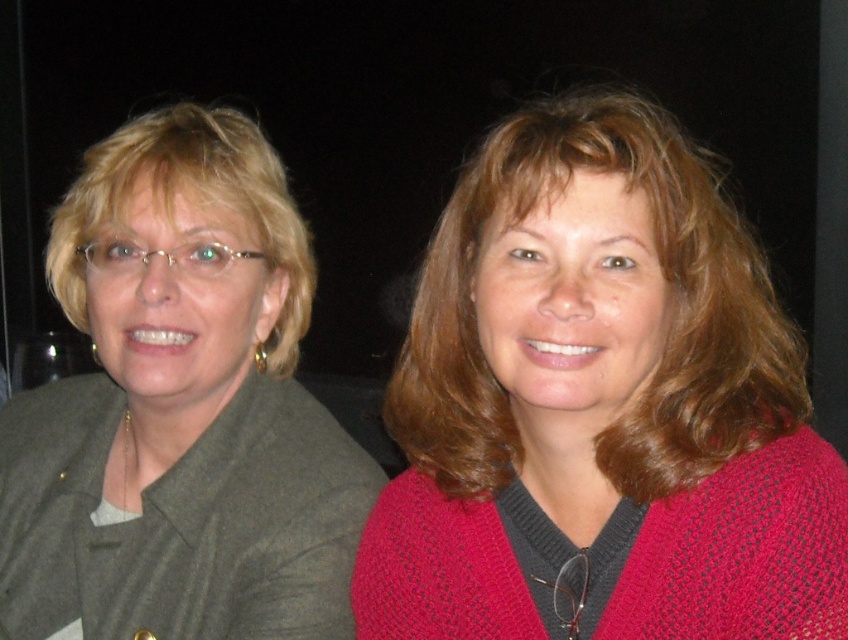
How far apart are knitted pink sweater at center and matte gray blazer at left?

knitted pink sweater at center and matte gray blazer at left are 12.92 inches apart from each other.

Find the location of a particular element. The height and width of the screenshot is (640, 848). knitted pink sweater at center is located at coordinates (600, 408).

Where is `knitted pink sweater at center`? knitted pink sweater at center is located at coordinates (600, 408).

Where is `knitted pink sweater at center`? Image resolution: width=848 pixels, height=640 pixels. knitted pink sweater at center is located at coordinates (600, 408).